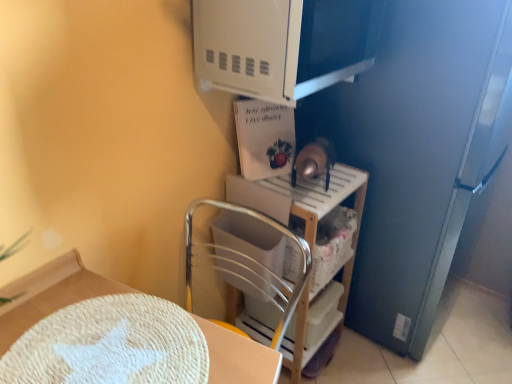
Question: Considering the relative sizes of wooden shelf at center and white matte microwave at upper center in the image provided, is wooden shelf at center bigger than white matte microwave at upper center?

Choices:
 (A) yes
 (B) no

Answer: (A)

Question: Considering the relative sizes of wooden shelf at center and white matte microwave at upper center in the image provided, is wooden shelf at center shorter than white matte microwave at upper center?

Choices:
 (A) no
 (B) yes

Answer: (A)

Question: Is wooden shelf at center positioned far away from white matte microwave at upper center?

Choices:
 (A) no
 (B) yes

Answer: (A)

Question: From a real-world perspective, is wooden shelf at center over white matte microwave at upper center?

Choices:
 (A) no
 (B) yes

Answer: (A)

Question: Does wooden shelf at center come behind white matte microwave at upper center?

Choices:
 (A) yes
 (B) no

Answer: (A)

Question: Is wooden shelf at center not within white matte microwave at upper center?

Choices:
 (A) yes
 (B) no

Answer: (A)

Question: Can white woven placemat at lower left be found inside wooden shelf at center?

Choices:
 (A) no
 (B) yes

Answer: (A)

Question: Can you confirm if wooden shelf at center is shorter than white woven placemat at lower left?

Choices:
 (A) no
 (B) yes

Answer: (A)

Question: From the image's perspective, is wooden shelf at center located beneath white woven placemat at lower left?

Choices:
 (A) no
 (B) yes

Answer: (A)

Question: From a real-world perspective, is wooden shelf at center positioned over white woven placemat at lower left based on gravity?

Choices:
 (A) no
 (B) yes

Answer: (A)

Question: Is wooden shelf at center directly adjacent to white woven placemat at lower left?

Choices:
 (A) yes
 (B) no

Answer: (B)

Question: From a real-world perspective, does wooden shelf at center sit lower than white woven placemat at lower left?

Choices:
 (A) no
 (B) yes

Answer: (B)

Question: Is white matte microwave at upper center further to the viewer compared to white woven placemat at lower left?

Choices:
 (A) no
 (B) yes

Answer: (B)